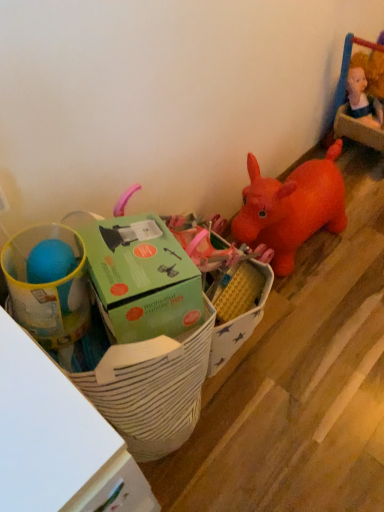
Locate an element on the screen. free spot in front of green cardboard box at center is located at coordinates (262, 434).